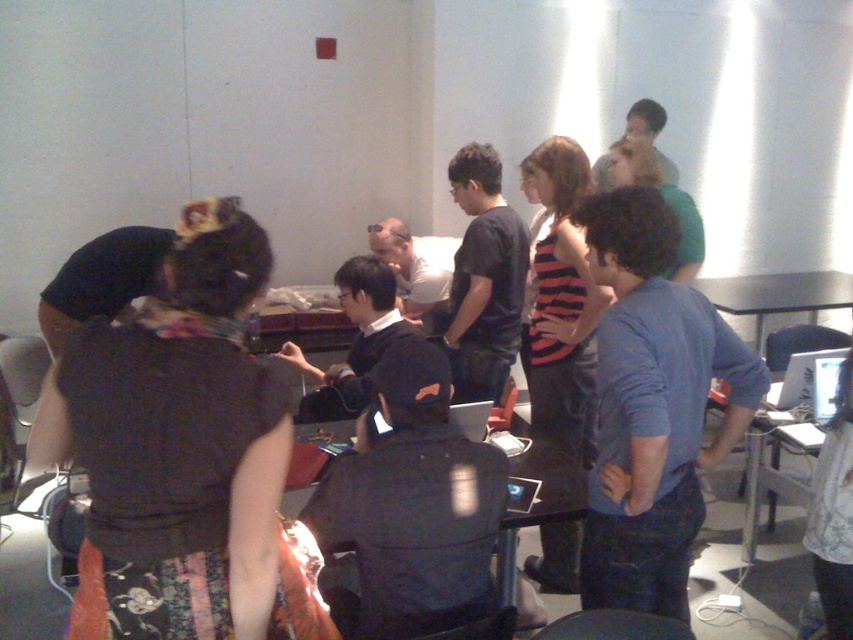
You are organizing a small event and need to determine seating arrangements. You have a dark gray fabric shirt at center and a black fabric stool at lower center. Which object is bigger?

The dark gray fabric shirt at center is larger than the black fabric stool at lower center according to the description.

You are standing in the room and see both the blue cotton shirt at center and the white lace shirt at center. Which shirt is positioned more to the left?

The blue cotton shirt at center is positioned more to the left than the white lace shirt at center.

You are standing at the entrance of the room and want to reach the black plastic table at center. Which direction should you move in to get there?

The black plastic table at center is located at point 0.761 on the x axis and 0.644 on the y axis, so you should move towards the center of the room to reach it.